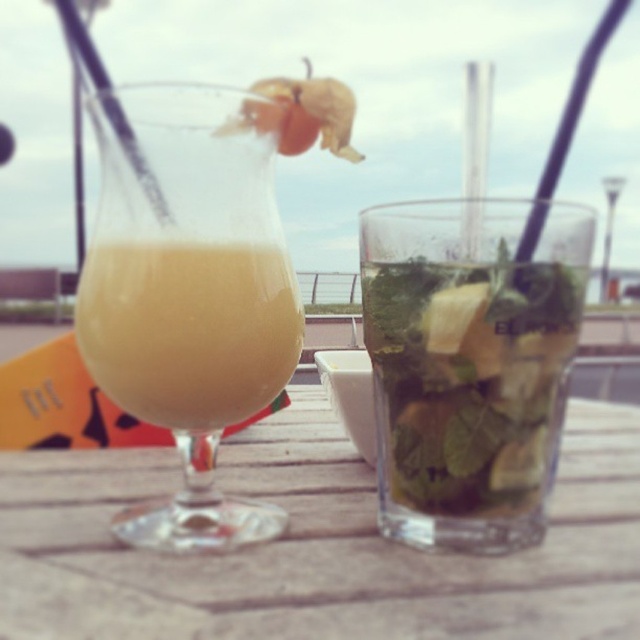
Which is in front, point (134, 390) or point (285, 132)?

Point (134, 390)

Does yellow translucent drink at left have a greater height compared to translucent red physalis at upper center?

Yes, yellow translucent drink at left is taller than translucent red physalis at upper center.

Who is more distant from viewer, (202,275) or (330,128)?

Point (330,128)

Image resolution: width=640 pixels, height=640 pixels. I want to click on yellow translucent drink at left, so click(x=188, y=330).

Between wooden table at center and translucent red physalis at upper center, which one appears on the right side from the viewer's perspective?

From the viewer's perspective, wooden table at center appears more on the right side.

Is wooden table at center positioned behind translucent red physalis at upper center?

No, it is not.

Describe the element at coordinates (316, 545) in the screenshot. I see `wooden table at center` at that location.

I want to click on wooden table at center, so click(316, 545).

From the picture: Is wooden table at center wider than translucent glass drink at left?

Yes, wooden table at center is wider than translucent glass drink at left.

Is point (266, 593) behind point (144, 419)?

No, (266, 593) is closer to viewer.

I want to click on wooden table at center, so click(x=316, y=545).